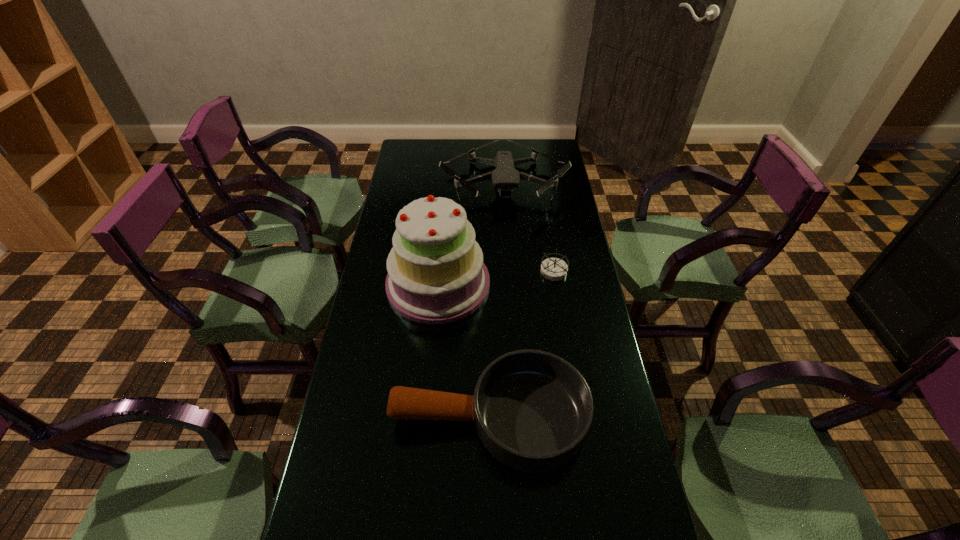
Identify the location of empty space between the pan and the cake. (464, 350).

You are a GUI agent. You are given a task and a screenshot of the screen. Output one action in this format:
    pyautogui.click(x=<x>, y=<y>)
    Task: Click on the free area in between the pan and the compass
    The width and height of the screenshot is (960, 540).
    Given the screenshot: What is the action you would take?
    pyautogui.click(x=521, y=345)

I want to click on free space between the nearest object and the drone, so click(x=496, y=301).

Where is `free space between the cake and the pan`? The height and width of the screenshot is (540, 960). free space between the cake and the pan is located at coordinates (464, 350).

Find the location of a particular element. The height and width of the screenshot is (540, 960). free space between the tallest object and the compass is located at coordinates (496, 278).

Select which object is the second closest to the shortest object. Please provide its 2D coordinates. Your answer should be formatted as a tuple, i.e. [(x, y)], where the tuple contains the x and y coordinates of a point satisfying the conditions above.

[(505, 177)]

Choose which object is the nearest neighbor to the tallest object. Please provide its 2D coordinates. Your answer should be formatted as a tuple, i.e. [(x, y)], where the tuple contains the x and y coordinates of a point satisfying the conditions above.

[(532, 410)]

The height and width of the screenshot is (540, 960). In order to click on vacant space that satisfies the following two spatial constraints: 1. on the front-facing side of the farthest object; 2. on the handle side of the pan in this screenshot , I will do `click(519, 417)`.

Where is `vacant space that satisfies the following two spatial constraints: 1. on the front-facing side of the farthest object; 2. on the handle side of the nearest object`? vacant space that satisfies the following two spatial constraints: 1. on the front-facing side of the farthest object; 2. on the handle side of the nearest object is located at coordinates (519, 417).

Image resolution: width=960 pixels, height=540 pixels. I want to click on free space in the image that satisfies the following two spatial constraints: 1. on the front-facing side of the shortest object; 2. on the right side of the farthest object, so click(x=510, y=272).